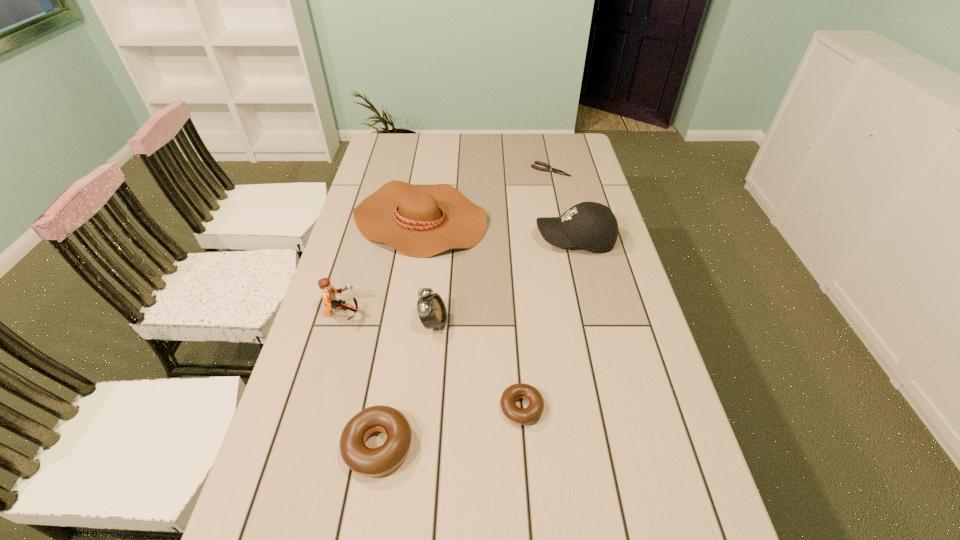
You are a GUI agent. You are given a task and a screenshot of the screen. Output one action in this format:
    pyautogui.click(x=<x>, y=<y>)
    Task: Click on the free space at the near right corner of the desktop
    
    Given the screenshot: What is the action you would take?
    pyautogui.click(x=694, y=516)

Identify the location of vacant area between the taller doughnut and the cowboy hat. Image resolution: width=960 pixels, height=540 pixels. (399, 332).

Find the location of a particular element. The height and width of the screenshot is (540, 960). vacant region between the baseball cap and the Lego is located at coordinates (459, 276).

Image resolution: width=960 pixels, height=540 pixels. I want to click on vacant point located between the cowboy hat and the alarm clock, so click(x=427, y=271).

In order to click on vacant region between the alarm clock and the baseball cap in this screenshot , I will do `click(504, 281)`.

Locate an element on the screen. vacant area between the alarm clock and the baseball cap is located at coordinates (504, 281).

Locate an element on the screen. The image size is (960, 540). vacant area that lies between the alarm clock and the taller doughnut is located at coordinates (406, 384).

Identify the location of free space that is in between the taller doughnut and the Lego. (361, 380).

This screenshot has height=540, width=960. What are the coordinates of `empty space between the alarm clock and the farthest object` in the screenshot? It's located at (492, 247).

Locate an element on the screen. The width and height of the screenshot is (960, 540). empty location between the right doughnut and the Lego is located at coordinates (432, 361).